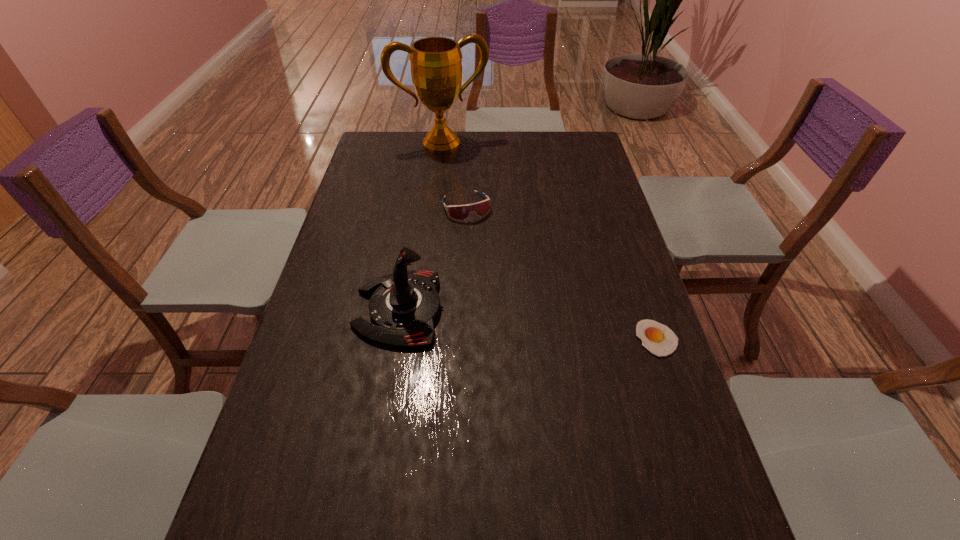
Identify the location of free space located on the front-facing side of the tallest object. The height and width of the screenshot is (540, 960). (462, 173).

Locate an element on the screen. free space located 0.190m on the front-facing side of the tallest object is located at coordinates (466, 183).

Identify the location of free space located 0.300m on the front-facing side of the third tallest object. [x=503, y=287].

At what (x,y) coordinates should I click in order to perform the action: click on free region located on the front-facing side of the third tallest object. Please return your answer as a coordinate pair (x, y). This screenshot has height=540, width=960. Looking at the image, I should click on (492, 264).

At what (x,y) coordinates should I click in order to perform the action: click on vacant space located on the front-facing side of the third tallest object. Please return your answer as a coordinate pair (x, y). Looking at the image, I should click on (495, 271).

Find the location of a particular element. The image size is (960, 540). object that is at the far edge is located at coordinates (436, 67).

Find the location of a particular element. This screenshot has height=540, width=960. joystick that is positioned at the left edge is located at coordinates (404, 305).

The width and height of the screenshot is (960, 540). Find the location of `award that is at the left edge`. award that is at the left edge is located at coordinates (436, 67).

Locate an element on the screen. This screenshot has height=540, width=960. object located in the right edge section of the desktop is located at coordinates (658, 339).

This screenshot has width=960, height=540. I want to click on object located at the far left corner, so click(436, 67).